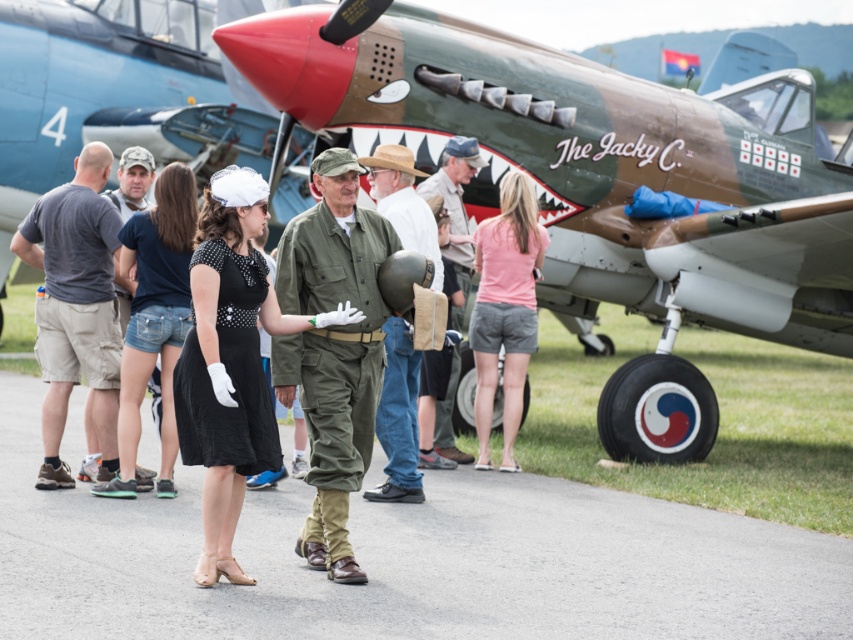
Between point (560, 296) and point (276, 385), which one is positioned behind?

The point (560, 296) is more distant.

Who is higher up, camouflage paint airplane at center or green fabric uniform at center?

Positioned higher is camouflage paint airplane at center.

Who is more distant from viewer, (680, 304) or (340, 369)?

Point (680, 304)

Image resolution: width=853 pixels, height=640 pixels. Identify the location of camouflage paint airplane at center. click(596, 184).

Is green camouflage airplane at upper right smaller than green fabric jacket at center?

Incorrect, green camouflage airplane at upper right is not smaller in size than green fabric jacket at center.

Looking at this image, does green camouflage airplane at upper right appear under green fabric jacket at center?

Incorrect, green camouflage airplane at upper right is not positioned below green fabric jacket at center.

Is point (24, 56) positioned before point (421, 246)?

That is False.

What are the coordinates of `green camouflage airplane at upper right` in the screenshot? It's located at (113, 92).

Looking at this image, which is above, green camouflage airplane at upper right or khaki fabric hat at center?

green camouflage airplane at upper right is higher up.

From the picture: Is green camouflage airplane at upper right behind khaki fabric hat at center?

Yes, it is.

This screenshot has width=853, height=640. I want to click on green camouflage airplane at upper right, so click(x=113, y=92).

The width and height of the screenshot is (853, 640). In order to click on green camouflage airplane at upper right in this screenshot , I will do `click(113, 92)`.